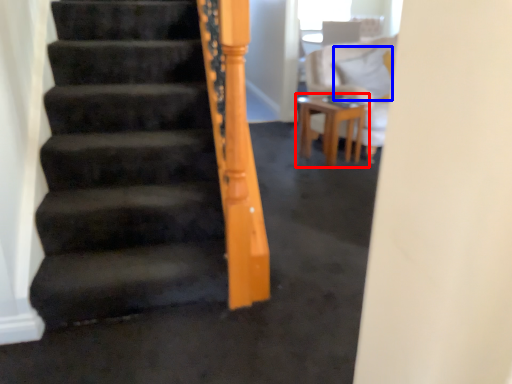
Question: Which point is closer to the camera, table (highlighted by a red box) or pillow (highlighted by a blue box)?

Choices:
 (A) table
 (B) pillow

Answer: (A)